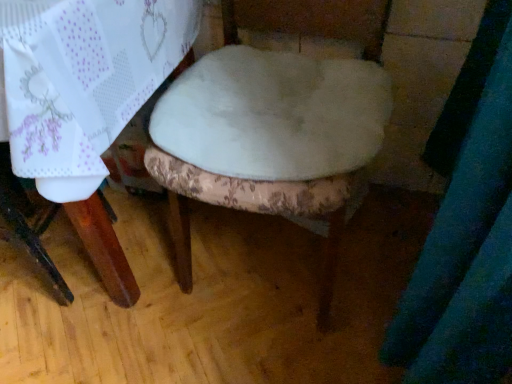
Image resolution: width=512 pixels, height=384 pixels. Describe the element at coordinates (274, 114) in the screenshot. I see `white fabric at center` at that location.

Find the location of a particular element. This screenshot has width=512, height=384. white fabric at center is located at coordinates (274, 114).

Measure the distance between white fabric chair at center and camera.

white fabric chair at center and camera are 28.14 inches apart from each other.

Where is `white fabric chair at center`? Image resolution: width=512 pixels, height=384 pixels. white fabric chair at center is located at coordinates (255, 211).

What do you see at coordinates (255, 211) in the screenshot? This screenshot has width=512, height=384. I see `white fabric chair at center` at bounding box center [255, 211].

Measure the distance between point (369, 27) and camera.

Point (369, 27) and camera are 35.91 inches apart.

At what (x,y) coordinates should I click in order to perform the action: click on white fabric at center. Please return your answer as a coordinate pair (x, y). Looking at the image, I should click on (274, 114).

In the image, is white fabric chair at center on the left side or the right side of white fabric at center?

In the image, white fabric chair at center appears on the right side of white fabric at center.

Which object is closer to the camera taking this photo, white fabric chair at center or white fabric at center?

white fabric chair at center.

Which is in front, point (324, 34) or point (317, 93)?

Point (317, 93)

From the image's perspective, is white fabric chair at center located beneath white fabric at center?

Yes, from the image's perspective, white fabric chair at center is beneath white fabric at center.

From a real-world perspective, which object stands above the other?

white fabric at center, from a real-world perspective.

Is white fabric chair at center thinner than white fabric at center?

No, white fabric chair at center is not thinner than white fabric at center.

Who is shorter, white fabric chair at center or white fabric at center?

white fabric at center.

Considering the relative sizes of white fabric chair at center and white fabric at center in the image provided, is white fabric chair at center bigger than white fabric at center?

Indeed, white fabric chair at center has a larger size compared to white fabric at center.

Is white fabric at center surrounded by white fabric chair at center?

Yes, white fabric at center is inside white fabric chair at center.

Is white fabric chair at center next to white fabric at center and touching it?

No, white fabric chair at center is not touching white fabric at center.

Is white fabric chair at center positioned with its back to white fabric at center?

Yes.

Where is `round table lying on the left of white fabric chair at center`? This screenshot has width=512, height=384. round table lying on the left of white fabric chair at center is located at coordinates click(x=274, y=114).

From the picture: Between white fabric at center and white fabric chair at center, which one appears on the left side from the viewer's perspective?

Positioned to the left is white fabric at center.

Does white fabric at center come in front of white fabric chair at center?

No, it is behind white fabric chair at center.

Does point (254, 113) come farther from viewer compared to point (272, 23)?

No.

From the image's perspective, is white fabric at center on top of white fabric chair at center?

Yes, from the image's perspective, white fabric at center is over white fabric chair at center.

From a real-world perspective, is white fabric at center physically above white fabric chair at center?

Correct, in the physical world, white fabric at center is higher than white fabric chair at center.

Considering the relative sizes of white fabric at center and white fabric chair at center in the image provided, is white fabric at center thinner than white fabric chair at center?

Indeed, white fabric at center has a lesser width compared to white fabric chair at center.

Which of these two, white fabric at center or white fabric chair at center, stands shorter?

white fabric at center.

Does white fabric at center have a larger size compared to white fabric chair at center?

Incorrect, white fabric at center is not larger than white fabric chair at center.

Consider the image. Is white fabric chair at center inside white fabric at center?

No, white fabric chair at center is not surrounded by white fabric at center.

Based on the photo, is white fabric at center next to white fabric chair at center?

No, white fabric at center is not making contact with white fabric chair at center.

Is white fabric at center oriented away from white fabric chair at center?

Yes.

The image size is (512, 384). What are the coordinates of `round table behind the white fabric chair at center` in the screenshot? It's located at (274, 114).

What are the coordinates of `round table above the white fabric chair at center (from a real-world perspective)` in the screenshot? It's located at (274, 114).

This screenshot has height=384, width=512. Identify the location of chair located on the right of white fabric at center. (255, 211).